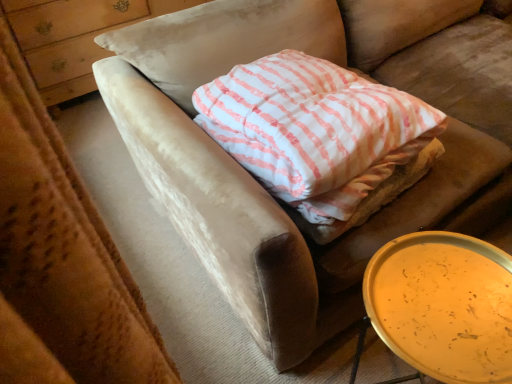
Describe the element at coordinates (417, 263) in the screenshot. I see `metallic gold tray at lower right` at that location.

Based on the photo, measure the distance between point (367, 91) and camera.

Point (367, 91) and camera are 3.81 feet apart.

This screenshot has width=512, height=384. I want to click on metallic gold tray at lower right, so click(x=417, y=263).

Does white striped fabric pillow at center have a lesser width compared to metallic gold tray at lower right?

No.

Which is behind, white striped fabric pillow at center or metallic gold tray at lower right?

white striped fabric pillow at center.

From a real-world perspective, which is physically below, white striped fabric pillow at center or metallic gold tray at lower right?

In real-world perspective, metallic gold tray at lower right is lower.

In the scene shown: Can you confirm if metallic gold tray at lower right is positioned to the right of wooden dresser at upper left?

Yes.

Which of these two, metallic gold tray at lower right or wooden dresser at upper left, stands taller?

Standing taller between the two is wooden dresser at upper left.

From a real-world perspective, is metallic gold tray at lower right on wooden dresser at upper left?

No, from a real-world perspective, metallic gold tray at lower right is not over wooden dresser at upper left

Considering the relative positions of wooden dresser at upper left and metallic gold tray at lower right in the image provided, is wooden dresser at upper left to the left of metallic gold tray at lower right from the viewer's perspective?

Indeed, wooden dresser at upper left is positioned on the left side of metallic gold tray at lower right.

You are a GUI agent. You are given a task and a screenshot of the screen. Output one action in this format:
    pyautogui.click(x=<x>, y=<y>)
    Task: Click on the table in front of the wooden dresser at upper left
    The image size is (512, 384).
    Given the screenshot: What is the action you would take?
    pyautogui.click(x=417, y=263)

Which of these two, wooden dresser at upper left or metallic gold tray at lower right, is smaller?

With smaller size is metallic gold tray at lower right.

Consider the image. Is white striped fabric pillow at center located outside wooden dresser at upper left?

Yes, white striped fabric pillow at center is outside of wooden dresser at upper left.

Considering the relative sizes of white striped fabric pillow at center and wooden dresser at upper left in the image provided, is white striped fabric pillow at center shorter than wooden dresser at upper left?

Yes.

Could you tell me if white striped fabric pillow at center is facing wooden dresser at upper left?

No, white striped fabric pillow at center is not facing towards wooden dresser at upper left.

From a real-world perspective, who is located higher, white striped fabric pillow at center or wooden dresser at upper left?

white striped fabric pillow at center is physically above.

Which is more to the left, wooden dresser at upper left or white striped fabric pillow at center?

wooden dresser at upper left is more to the left.

Is wooden dresser at upper left bigger or smaller than white striped fabric pillow at center?

Considering their sizes, wooden dresser at upper left takes up more space than white striped fabric pillow at center.

Is wooden dresser at upper left inside the boundaries of white striped fabric pillow at center, or outside?

wooden dresser at upper left is located beyond the bounds of white striped fabric pillow at center.

Is wooden dresser at upper left turned away from white striped fabric pillow at center?

No.

Identify the location of pillow above the metallic gold tray at lower right (from the image's perspective). This screenshot has height=384, width=512. (309, 123).

Consider the image. Measure the distance between metallic gold tray at lower right and white striped fabric pillow at center.

A distance of 15.23 inches exists between metallic gold tray at lower right and white striped fabric pillow at center.

Is metallic gold tray at lower right oriented towards white striped fabric pillow at center?

No, metallic gold tray at lower right is not aimed at white striped fabric pillow at center.

Is metallic gold tray at lower right outside of white striped fabric pillow at center?

Yes, metallic gold tray at lower right is outside of white striped fabric pillow at center.

This screenshot has height=384, width=512. Find the location of `table below the white striped fabric pillow at center (from a real-world perspective)`. table below the white striped fabric pillow at center (from a real-world perspective) is located at coordinates (417, 263).

Identify the location of dresser that is above the metallic gold tray at lower right (from a real-world perspective). The height and width of the screenshot is (384, 512). (75, 38).

From the image, which object appears to be nearer to wooden dresser at upper left, white striped fabric pillow at center or metallic gold tray at lower right?

A: Based on the image, white striped fabric pillow at center appears to be nearer to wooden dresser at upper left.

Considering their positions, is wooden dresser at upper left positioned closer to metallic gold tray at lower right than white striped fabric pillow at center?

Among the two, white striped fabric pillow at center is located nearer to metallic gold tray at lower right.

Based on their spatial positions, is metallic gold tray at lower right or wooden dresser at upper left further from white striped fabric pillow at center?

wooden dresser at upper left is further to white striped fabric pillow at center.

When comparing their distances from wooden dresser at upper left, does metallic gold tray at lower right or white striped fabric pillow at center seem further?

metallic gold tray at lower right lies further to wooden dresser at upper left than the other object.

From the image, which object appears to be nearer to metallic gold tray at lower right, white striped fabric pillow at center or wooden dresser at upper left?

white striped fabric pillow at center.

When comparing their distances from white striped fabric pillow at center, does wooden dresser at upper left or metallic gold tray at lower right seem further?

wooden dresser at upper left.

In order to click on pillow between wooden dresser at upper left and metallic gold tray at lower right in the up-down direction in this screenshot , I will do point(309,123).